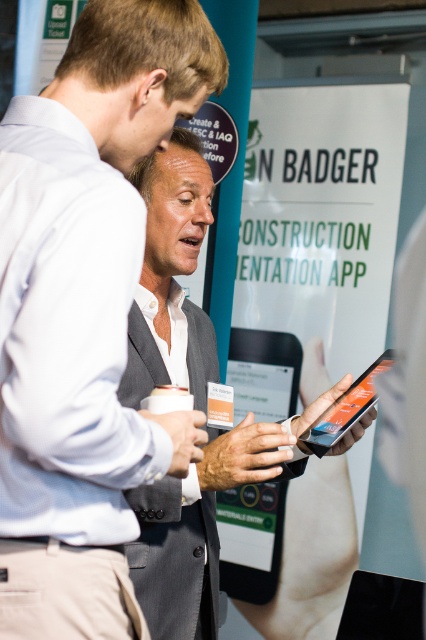
You are organizing a presentation and need to place both the gray fabric suit at center and the black matte tablet at center on a table. If the table has limited space, which object should you prioritize placing first to ensure both fit?

The black matte tablet at center should be placed first since the gray fabric suit at center is larger in size and might take up more space, allowing the smaller tablet to fit alongside.

You are standing at the origin point of the coordinate system in the image. The gray suit jacket at center is located at point 0.820, 0.469. If you want to walk directly towards it, in which direction should you move?

To move towards the gray suit jacket at center located at coordinates (199, 524) from the origin, you should move in the positive x and positive y direction.